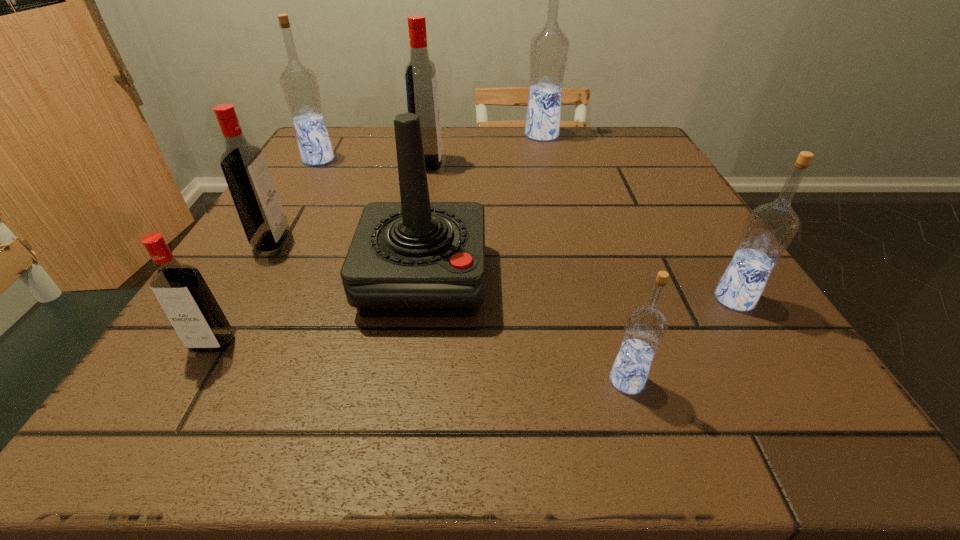
The image size is (960, 540). In order to click on the third biggest blue vodka in this screenshot , I will do `click(769, 229)`.

This screenshot has height=540, width=960. What are the coordinates of `the second nearest object` in the screenshot? It's located at (182, 292).

Where is `the second nearest vodka`? This screenshot has height=540, width=960. the second nearest vodka is located at coordinates (182, 292).

This screenshot has width=960, height=540. Identify the location of the nearest vodka. (645, 327).

Locate an element on the screen. Image resolution: width=960 pixels, height=540 pixels. the nearest blue vodka is located at coordinates (645, 327).

Identify the location of vacant space situated on the front of the biggest blue vodka. (559, 201).

Locate an element on the screen. The height and width of the screenshot is (540, 960). free space located on the front of the second biggest blue vodka is located at coordinates (268, 243).

Find the location of a particular element. The image size is (960, 540). free space located on the front and back of the rightmost red vodka is located at coordinates (486, 164).

Locate an element on the screen. The image size is (960, 540). free space located on the front-facing side of the joystick is located at coordinates (410, 374).

Find the location of a particular element. free space located 0.130m on the front and back of the second nearest red vodka is located at coordinates (359, 240).